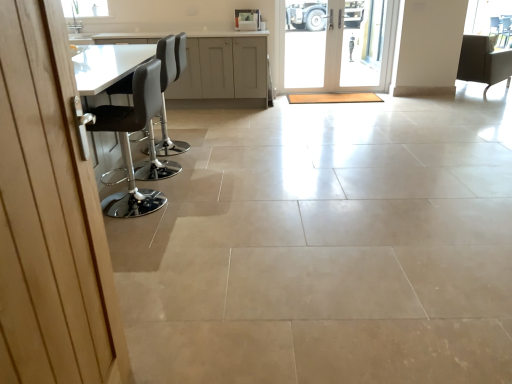
Question: Does matte gray cabinets at upper center have a greater width compared to matte black chair at upper right, placed as the third chair when sorted from front to back?

Choices:
 (A) no
 (B) yes

Answer: (A)

Question: Does matte gray cabinets at upper center appear on the left side of matte black chair at upper right, placed as the third chair when sorted from front to back?

Choices:
 (A) yes
 (B) no

Answer: (A)

Question: Can you confirm if matte gray cabinets at upper center is thinner than matte black chair at upper right, which is the 1th chair in right-to-left order?

Choices:
 (A) yes
 (B) no

Answer: (A)

Question: From a real-world perspective, is matte gray cabinets at upper center located higher than matte black chair at upper right, the 3th chair in the left-to-right sequence?

Choices:
 (A) no
 (B) yes

Answer: (B)

Question: Considering the relative positions of matte gray cabinets at upper center and matte black chair at upper right, which is the 1th chair in right-to-left order, in the image provided, is matte gray cabinets at upper center behind matte black chair at upper right, which is the 1th chair in right-to-left order,?

Choices:
 (A) no
 (B) yes

Answer: (A)

Question: In terms of width, does white glass door at center, which is the first door from right to left, look wider or thinner when compared to white leather bar stool at left, which appears as the second chair when viewed from the back?

Choices:
 (A) thin
 (B) wide

Answer: (A)

Question: In the image, is white glass door at center, the second door positioned from the front, positioned in front of or behind white leather bar stool at left, placed as the 1th chair when sorted from left to right?

Choices:
 (A) front
 (B) behind

Answer: (B)

Question: From their relative heights in the image, would you say white glass door at center, the first door in the top-to-bottom sequence, is taller or shorter than white leather bar stool at left, which appears as the second chair when viewed from the back?

Choices:
 (A) short
 (B) tall

Answer: (B)

Question: Does point click(x=390, y=9) appear closer or farther from the camera than point click(x=163, y=87)?

Choices:
 (A) farther
 (B) closer

Answer: (A)

Question: Is transparent glass window screen at upper right in front of or behind wooden door at left, which is the first door in left-to-right order, in the image?

Choices:
 (A) front
 (B) behind

Answer: (B)

Question: Is transparent glass window screen at upper right taller or shorter than wooden door at left, which is the first door in left-to-right order?

Choices:
 (A) short
 (B) tall

Answer: (A)

Question: From the image's perspective, is transparent glass window screen at upper right above or below wooden door at left, positioned as the first door in front-to-back order?

Choices:
 (A) below
 (B) above

Answer: (B)

Question: Choose the correct answer: Is transparent glass window screen at upper right inside wooden door at left, the 2th door in the right-to-left sequence, or outside it?

Choices:
 (A) inside
 (B) outside

Answer: (B)

Question: In terms of width, does matte gray cabinets at upper center look wider or thinner when compared to matte black chair at upper right, which is the 1th chair in back-to-front order?

Choices:
 (A) wide
 (B) thin

Answer: (B)

Question: From a real-world perspective, relative to matte black chair at upper right, which is the 1th chair in right-to-left order, is matte gray cabinets at upper center vertically above or below?

Choices:
 (A) below
 (B) above

Answer: (B)